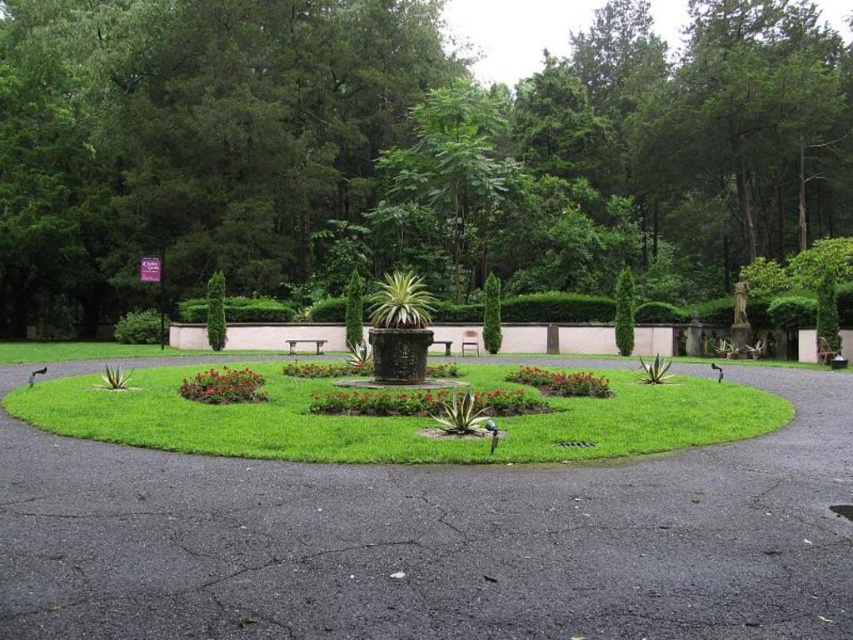
Between green leafy tree at center and green textured planter at center, which one appears on the left side from the viewer's perspective?

green textured planter at center is more to the left.

What do you see at coordinates (403, 150) in the screenshot?
I see `green leafy tree at center` at bounding box center [403, 150].

Is point (0, 58) positioned after point (416, 282)?

Yes.

Image resolution: width=853 pixels, height=640 pixels. Find the location of `green leafy tree at center`. green leafy tree at center is located at coordinates (403, 150).

Does wooden park bench at center have a greater height compared to wooden bench at center?

In fact, wooden park bench at center may be shorter than wooden bench at center.

What do you see at coordinates (305, 342) in the screenshot?
I see `wooden park bench at center` at bounding box center [305, 342].

Locate an element on the screen. This screenshot has width=853, height=640. wooden park bench at center is located at coordinates (305, 342).

Between green textured bush at center and brown wooden bench at center, which one appears on the left side from the viewer's perspective?

Positioned to the left is brown wooden bench at center.

Does point (486, 304) come behind point (474, 352)?

No, it is in front of (474, 352).

Describe the element at coordinates (491, 314) in the screenshot. The image size is (853, 640). I see `green textured bush at center` at that location.

Find the location of `green textured bush at center`. green textured bush at center is located at coordinates click(x=491, y=314).